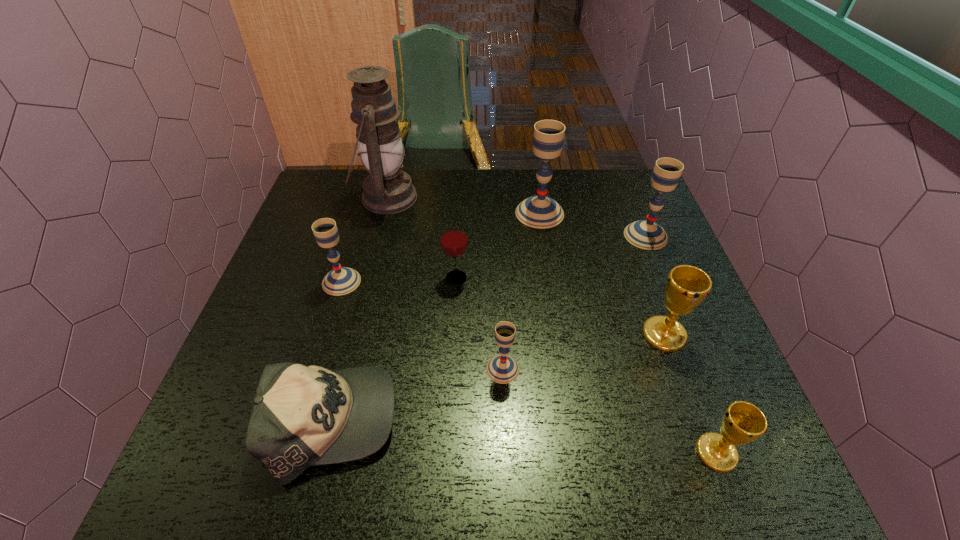
Locate an element on the screen. Image resolution: width=960 pixels, height=540 pixels. vacant area situated on the left of the third tallest object is located at coordinates (552, 236).

Identify the location of free space located 0.170m on the front of the third farthest gray chalice. (320, 355).

Locate an element on the screen. blank space located on the left of the bigger gold chalice is located at coordinates (616, 334).

Where is `vacant space situated 0.230m on the front of the fourth object from left to right`? The image size is (960, 540). vacant space situated 0.230m on the front of the fourth object from left to right is located at coordinates (451, 368).

Image resolution: width=960 pixels, height=540 pixels. Find the location of `vacant region located 0.120m on the left of the second chalice from left to right`. vacant region located 0.120m on the left of the second chalice from left to right is located at coordinates pos(428,369).

The width and height of the screenshot is (960, 540). In order to click on vacant space located on the left of the nearer gold chalice in this screenshot , I will do `click(526, 453)`.

Locate an element on the screen. free space located on the front-facing side of the baseball cap is located at coordinates (549, 423).

Locate an element on the screen. oil lamp located in the far edge section of the desktop is located at coordinates (386, 190).

Where is `chalice at the far edge`? chalice at the far edge is located at coordinates (539, 211).

Where is `chalice positioned at the near edge`? The height and width of the screenshot is (540, 960). chalice positioned at the near edge is located at coordinates (742, 422).